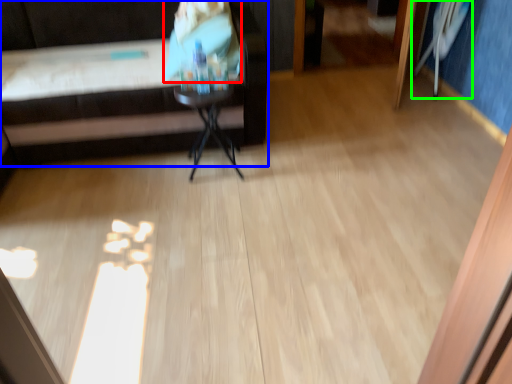
Question: Based on their relative distances, which object is farther from person (highlighted by a red box)? Choose from furniture (highlighted by a blue box) and swivel chair (highlighted by a green box).

Choices:
 (A) furniture
 (B) swivel chair

Answer: (B)